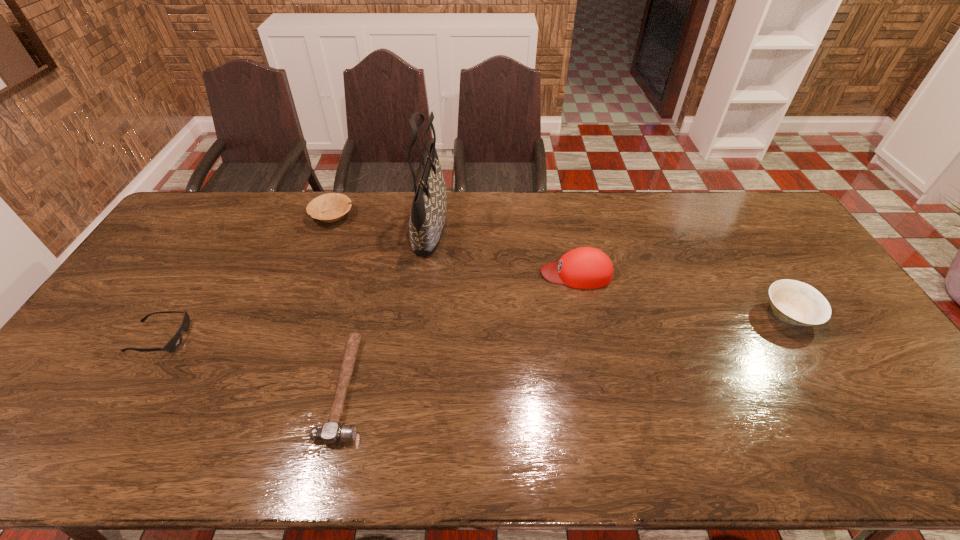
Where is `the tallest object`? This screenshot has width=960, height=540. the tallest object is located at coordinates (427, 219).

Image resolution: width=960 pixels, height=540 pixels. Find the location of `the third object from right to left`. the third object from right to left is located at coordinates (427, 219).

You are a GUI agent. You are given a task and a screenshot of the screen. Output one action in this format:
    pyautogui.click(x=<x>, y=<y>)
    Task: Click on the baseball cap
    Image resolution: width=960 pixels, height=540 pixels.
    Given the screenshot: What is the action you would take?
    pyautogui.click(x=586, y=267)

You are a GUI agent. You are given a task and a screenshot of the screen. Output one action in this format:
    pyautogui.click(x=<x>, y=<y>)
    Task: Click on the second object from right to left
    
    Given the screenshot: What is the action you would take?
    pyautogui.click(x=586, y=267)

The width and height of the screenshot is (960, 540). Find the location of `the taller bowl`. the taller bowl is located at coordinates (794, 302).

At what (x,y) coordinates should I click in order to perform the action: click on the right bowl. Please return your answer as a coordinate pair (x, y). Image resolution: width=960 pixels, height=540 pixels. Looking at the image, I should click on (794, 302).

Locate an element on the screen. Image resolution: width=960 pixels, height=540 pixels. the second object from left to right is located at coordinates (334, 206).

Find the location of a particular element. The image size is (960, 540). the fourth tallest object is located at coordinates (334, 206).

Locate an element on the screen. sunglasses is located at coordinates (175, 341).

Locate an element on the screen. hammer is located at coordinates (331, 433).